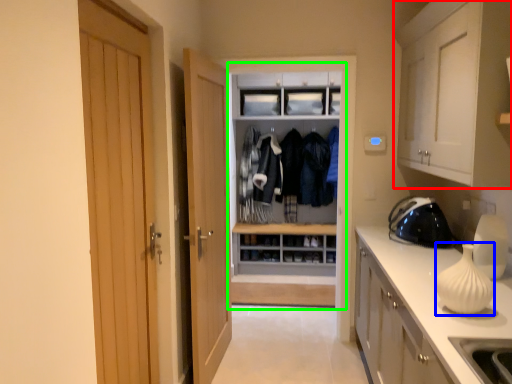
Question: Which object is the farthest from cabinetry (highlighted by a red box)? Choose among these: vase (highlighted by a blue box) or dresser (highlighted by a green box).

Choices:
 (A) vase
 (B) dresser

Answer: (B)